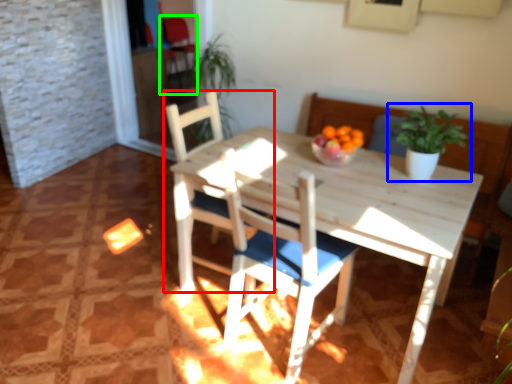
Question: Based on their relative distances, which object is farther from chair (highlighted by a red box)? Choose from houseplant (highlighted by a blue box) and armchair (highlighted by a green box).

Choices:
 (A) houseplant
 (B) armchair

Answer: (B)